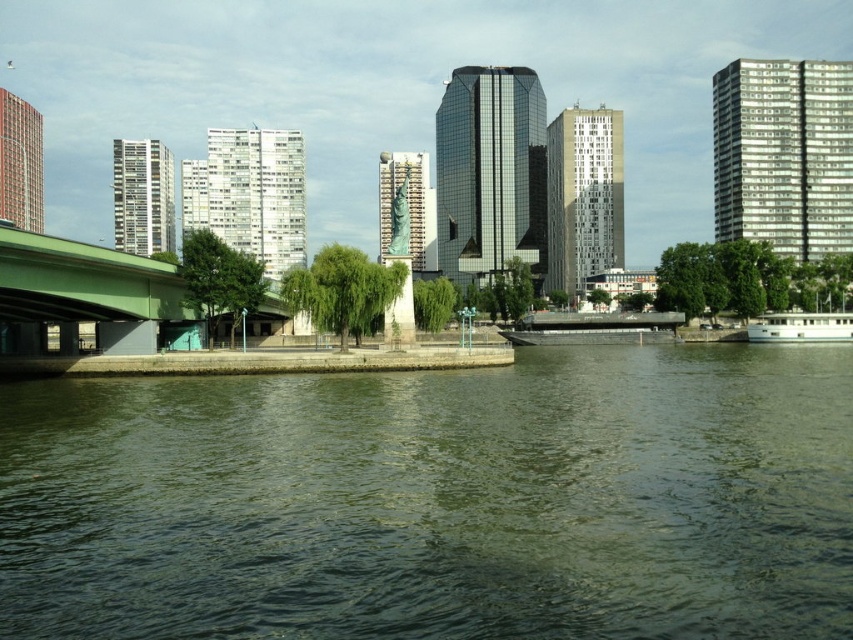
Question: Estimate the real-world distances between objects in this image. Which object is farther from the white glass building at upper right?

Choices:
 (A) green water at center
 (B) white matte boat at lower right
 (C) green concrete bridge at left

Answer: (A)

Question: Which object appears farthest from the camera in this image?

Choices:
 (A) green water at center
 (B) green concrete bridge at left

Answer: (B)

Question: Is green concrete bridge at left to the right of red brick building at upper left from the viewer's perspective?

Choices:
 (A) no
 (B) yes

Answer: (B)

Question: Where is white glass building at upper right located in relation to glossy glass skyscraper at center in the image?

Choices:
 (A) left
 (B) right

Answer: (B)

Question: Which object is positioned farthest from the white matte boat at lower right?

Choices:
 (A) green concrete bridge at left
 (B) dark gray metallic barge at center
 (C) red brick building at upper left
 (D) bronze statue at center

Answer: (C)

Question: Can you confirm if glossy glass skyscraper at center is smaller than bronze statue at center?

Choices:
 (A) no
 (B) yes

Answer: (B)